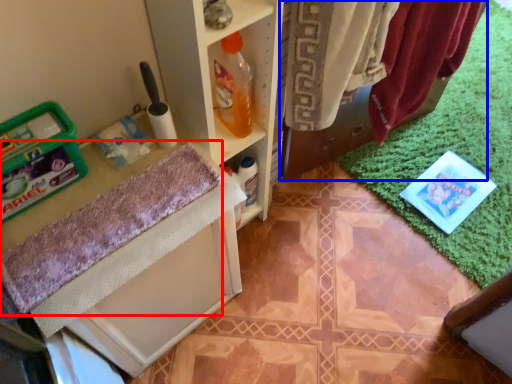
Question: Which object is further to the camera taking this photo, bath towel (highlighted by a red box) or laundry (highlighted by a blue box)?

Choices:
 (A) bath towel
 (B) laundry

Answer: (B)